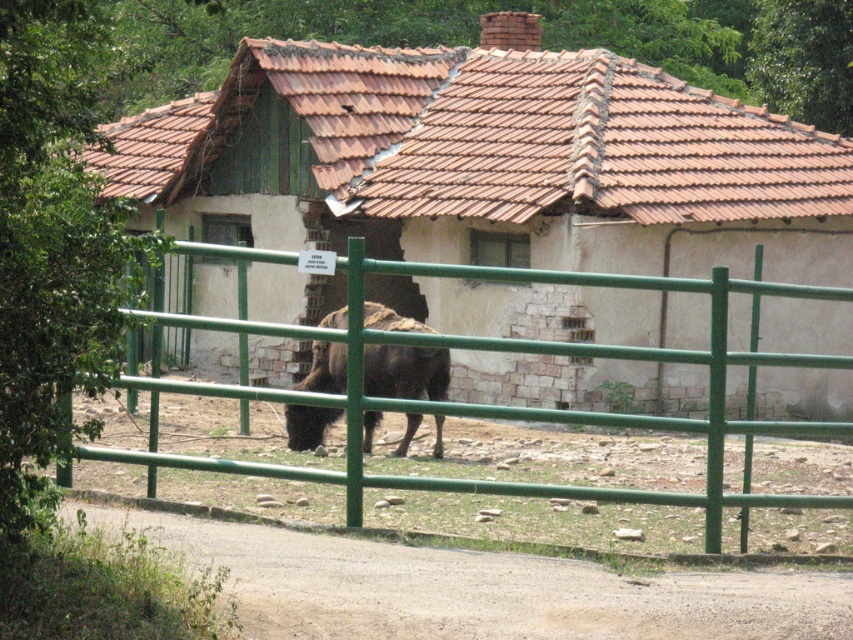
Question: Can you confirm if white stone hut at center is wider than green metal fence at center?

Choices:
 (A) no
 (B) yes

Answer: (A)

Question: Which point is farther to the camera?

Choices:
 (A) (374, 396)
 (B) (244, 332)

Answer: (A)

Question: Among these points, which one is farthest from the camera?

Choices:
 (A) (412, 353)
 (B) (677, 246)

Answer: (B)

Question: Which object is farther from the camera taking this photo?

Choices:
 (A) green metal fence at center
 (B) brown furry yak at center
 (C) white stone hut at center

Answer: (C)

Question: Does white stone hut at center appear over green metal fence at center?

Choices:
 (A) no
 (B) yes

Answer: (B)

Question: Does white stone hut at center come in front of brown furry yak at center?

Choices:
 (A) no
 (B) yes

Answer: (A)